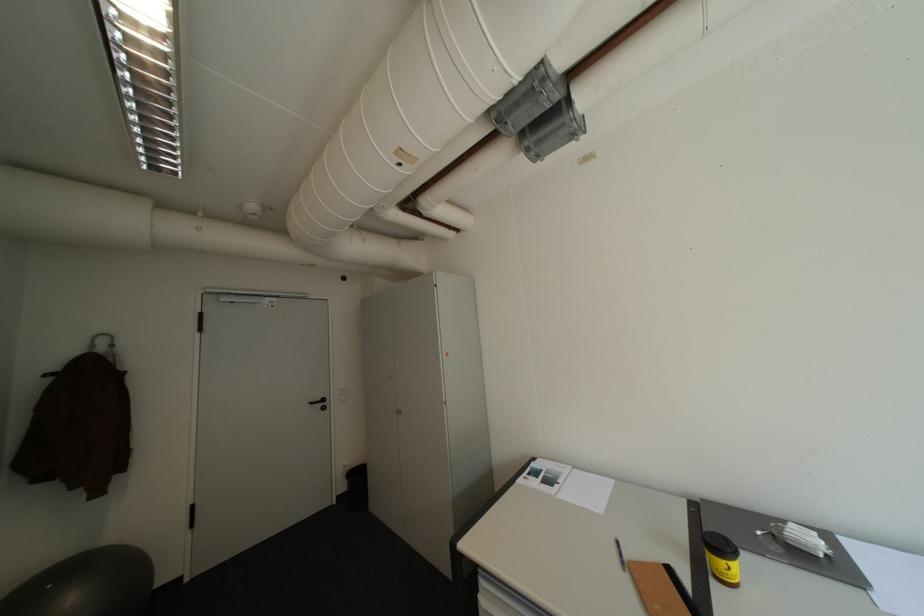
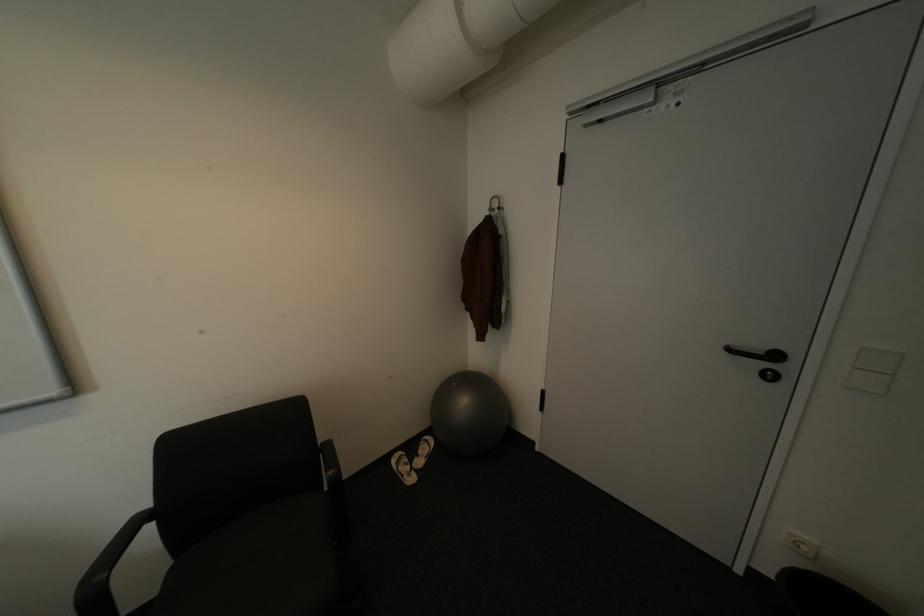
The point at (321, 403) is marked in the first image. Where is the corresponding point in the second image?

(739, 350)